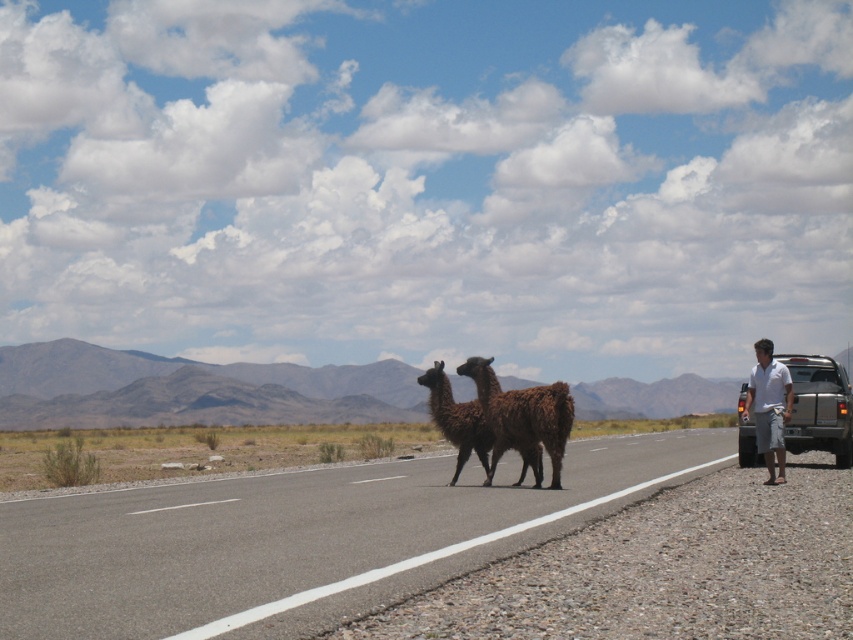
You are driving a car and want to pass the silver metallic truck at right safely. Based on the scene description, where should you position your car relative to the truck to avoid the alpacas on the road?

The silver metallic truck at right is located at point [819,406], so you should position your car to the left side of the road, away from the truck and the alpacas to ensure a safe passage.